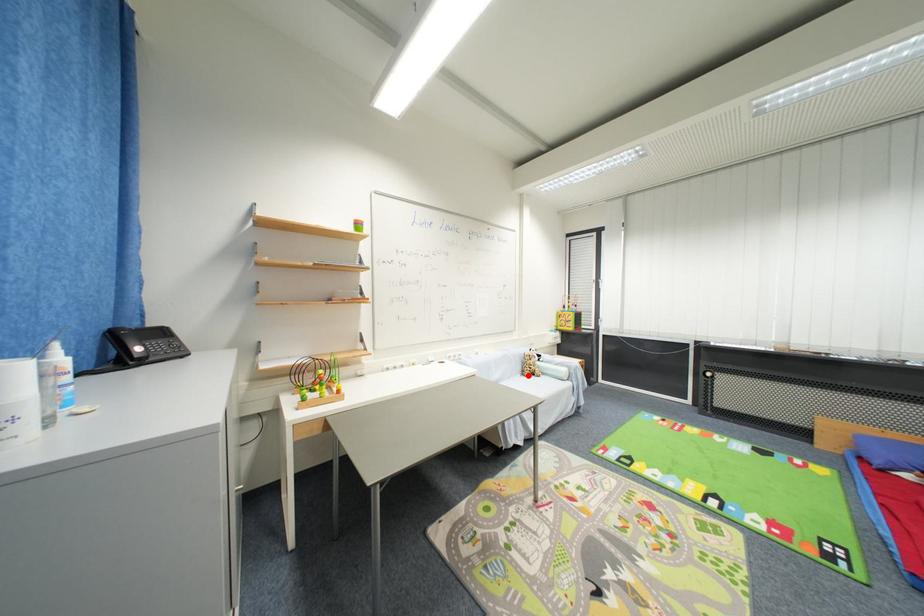
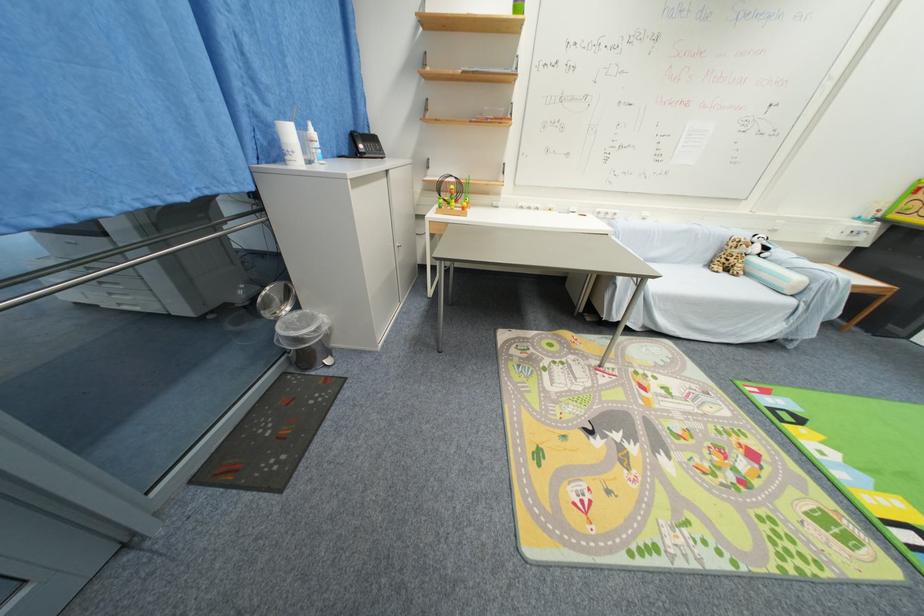
The point at the highlighted location is marked in the first image. Where is the corresponding point in the second image?

(714, 265)